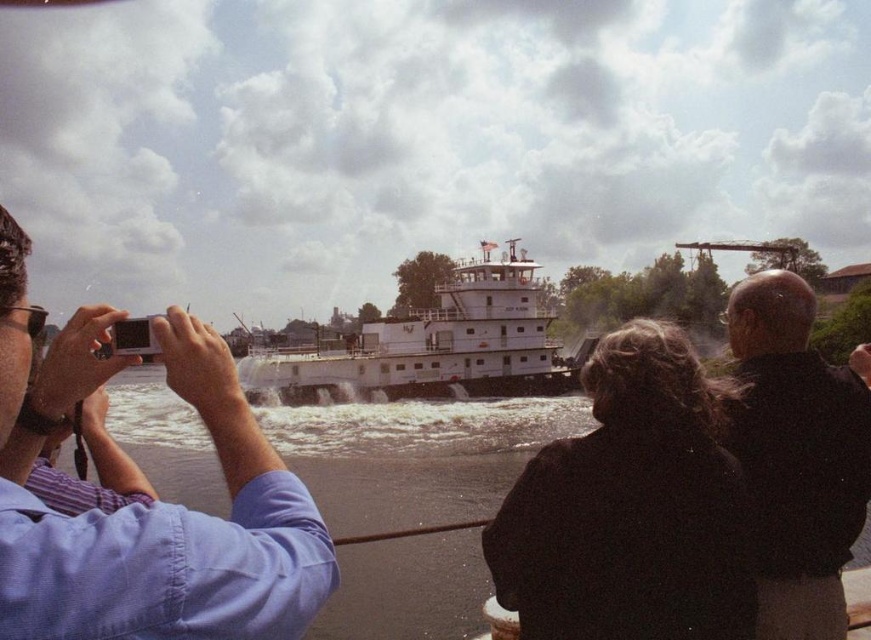
Which is in front, point (753, 330) or point (287, 378)?

Point (753, 330) is in front.

Is point (822, 451) farther from camera compared to point (520, 330)?

No, (822, 451) is in front of (520, 330).

Locate an element on the screen. The width and height of the screenshot is (871, 640). black leather jacket at upper right is located at coordinates (797, 452).

Which is behind, point (125, 573) or point (787, 340)?

Positioned behind is point (787, 340).

Which is more to the left, matte white camera at left or black leather jacket at upper right?

From the viewer's perspective, matte white camera at left appears more on the left side.

At what (x,y) coordinates should I click in order to perform the action: click on matte white camera at left. Please return your answer as a coordinate pair (x, y). Looking at the image, I should click on (150, 504).

Who is more distant from viewer, (140,536) or (287,348)?

The point (287,348) is behind.

Between matte white camera at left and white matte tugboat at center, which one has more height?

white matte tugboat at center

Between point (302, 545) and point (498, 392), which one is positioned in front?

Point (302, 545) is in front.

You are a GUI agent. You are given a task and a screenshot of the screen. Output one action in this format:
    pyautogui.click(x=<x>, y=<y>)
    Task: Click on the matte white camera at left
    
    Given the screenshot: What is the action you would take?
    pyautogui.click(x=150, y=504)